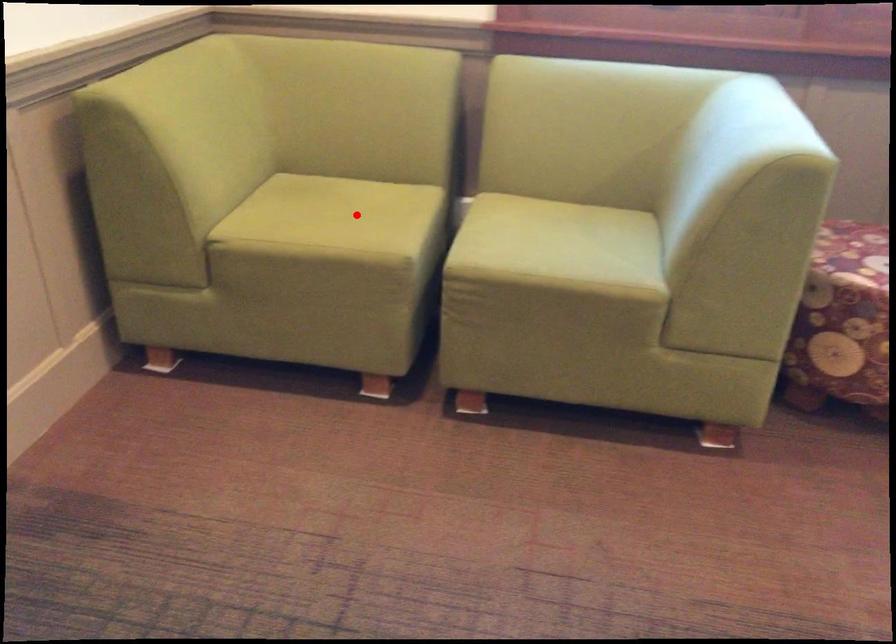
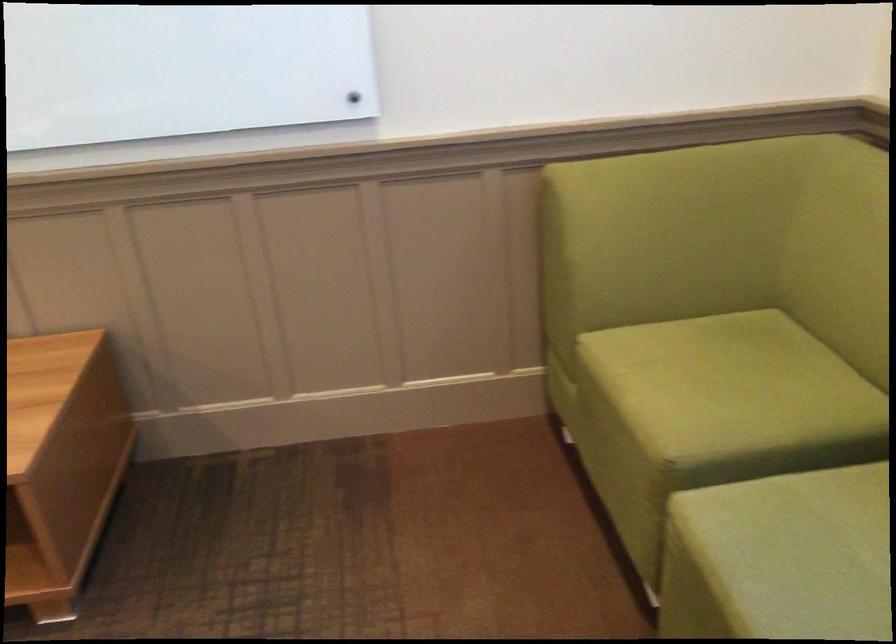
Question: A red point is marked in image1. In image2, is the corresponding 3D point closer to the camera or farther? Reply with the corresponding letter.

Choices:
 (A) The corresponding 3D point is closer.
 (B) The corresponding 3D point is farther.

Answer: (A)